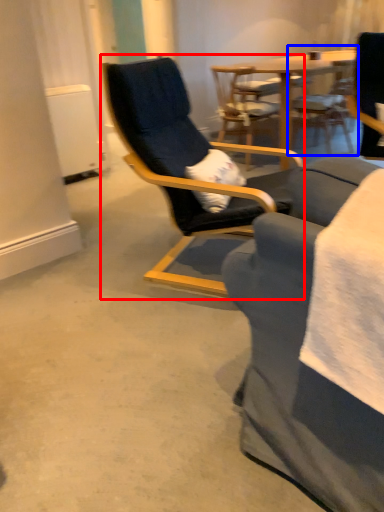
Question: Which point is closer to the camera, chair (highlighted by a red box) or chair (highlighted by a blue box)?

Choices:
 (A) chair
 (B) chair

Answer: (A)